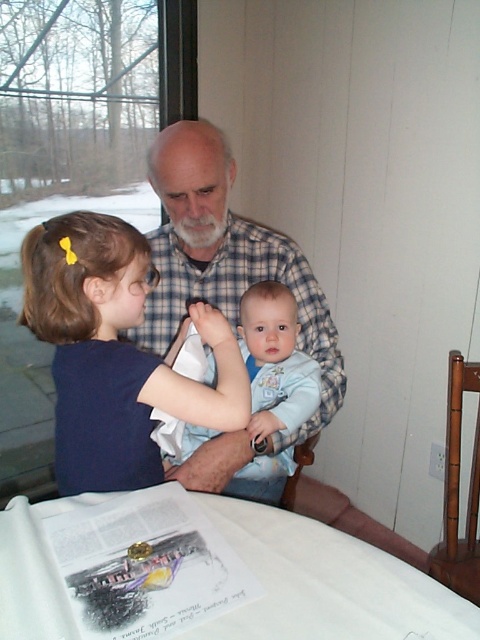
Question: Which object appears farthest from the camera in this image?

Choices:
 (A) light blue soft fabric baby at center
 (B) white paper at lower center

Answer: (A)

Question: Can you confirm if white paper at lower center is bigger than matte blue shirt at left?

Choices:
 (A) no
 (B) yes

Answer: (A)

Question: Among these points, which one is farthest from the camera?

Choices:
 (A) (312, 618)
 (B) (214, 189)
 (C) (304, 362)

Answer: (B)

Question: Is white paper at lower center smaller than plaid shirt at center?

Choices:
 (A) no
 (B) yes

Answer: (B)

Question: Is white paper at lower center bigger than light blue soft fabric baby at center?

Choices:
 (A) yes
 (B) no

Answer: (B)

Question: Which point is farther from the camera taking this photo?

Choices:
 (A) (126, 221)
 (B) (179, 195)

Answer: (B)